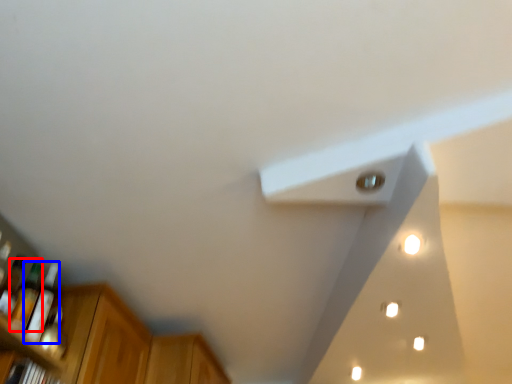
Question: Among these objects, which one is farthest to the camera, bottle (highlighted by a red box) or bottle (highlighted by a blue box)?

Choices:
 (A) bottle
 (B) bottle

Answer: (B)